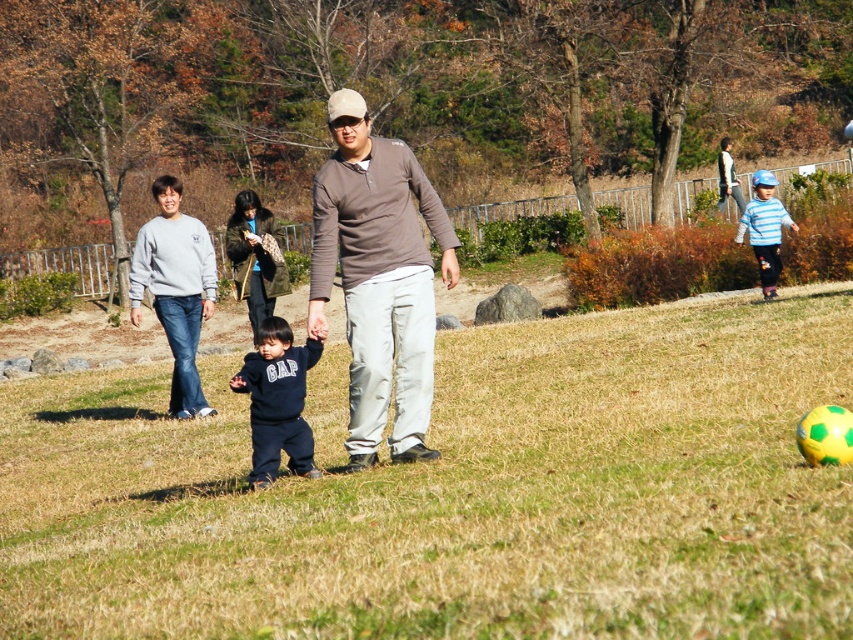
Question: Which object is the closest to the gray sweatshirt at left?

Choices:
 (A) blue striped sweater at right
 (B) brown dry grass at center
 (C) matte brown shirt at center
 (D) navy blue sweater at center

Answer: (D)

Question: Which point is farther to the camera?

Choices:
 (A) (759, 266)
 (B) (257, 408)

Answer: (A)

Question: Which object is positioned farthest from the blue striped sweater at right?

Choices:
 (A) dark blue cotton sweater at center
 (B) matte brown shirt at center
 (C) brown dry grass at center
 (D) gray sweatshirt at left

Answer: (A)

Question: Where is gray sweatshirt at left located in relation to navy blue sweater at center in the image?

Choices:
 (A) right
 (B) left

Answer: (B)

Question: Can you confirm if gray sweatshirt at left is positioned below blue striped sweater at right?

Choices:
 (A) yes
 (B) no

Answer: (A)

Question: Is matte brown shirt at center further to the viewer compared to navy blue sweater at center?

Choices:
 (A) yes
 (B) no

Answer: (B)